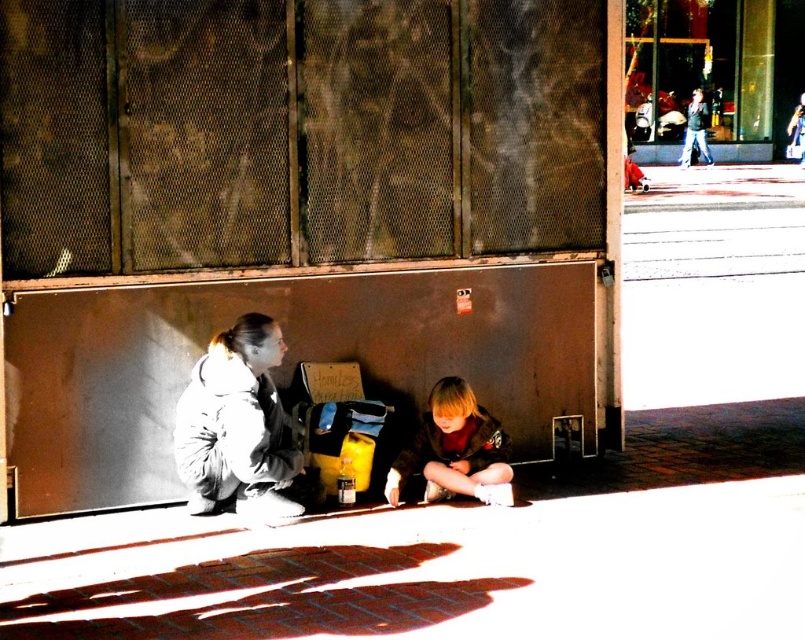
Question: Does white fleece jacket at lower left come in front of blonde hair boy at lower center?

Choices:
 (A) yes
 (B) no

Answer: (A)

Question: From the image, what is the correct spatial relationship of white fleece jacket at lower left in relation to blonde hair boy at lower center?

Choices:
 (A) left
 (B) right

Answer: (A)

Question: Which object is farther from the camera taking this photo?

Choices:
 (A) white fleece jacket at lower left
 (B) dark gray jacket at upper right

Answer: (B)

Question: Estimate the real-world distances between objects in this image. Which object is closer to the white fleece jacket at lower left?

Choices:
 (A) dark gray jacket at upper right
 (B) blonde hair boy at lower center

Answer: (B)

Question: Estimate the real-world distances between objects in this image. Which object is closer to the dark gray jacket at upper right?

Choices:
 (A) white fleece jacket at lower left
 (B) blonde hair boy at lower center

Answer: (B)

Question: Does blonde hair boy at lower center have a lesser width compared to dark gray jacket at upper right?

Choices:
 (A) no
 (B) yes

Answer: (B)